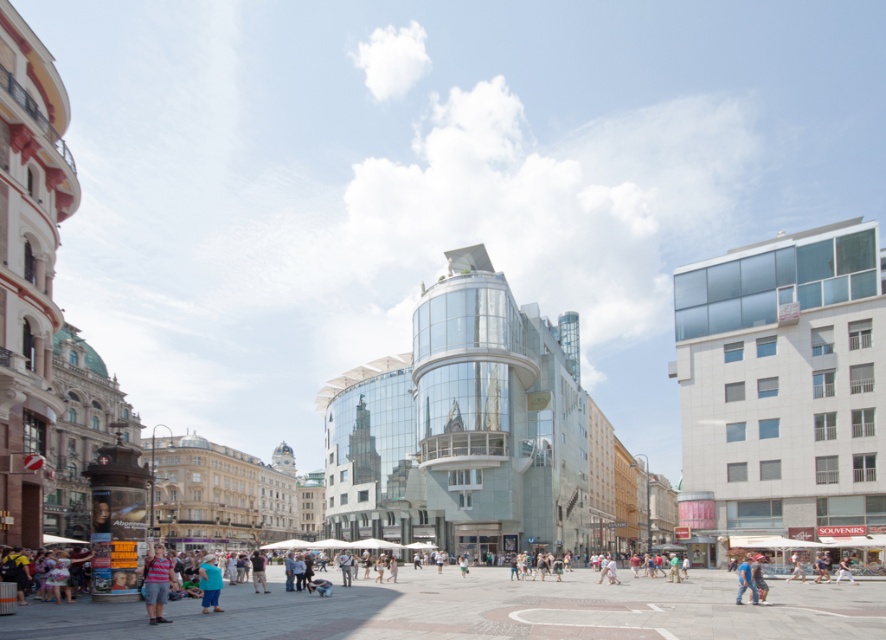
You are a fashion designer observing a person in the urban square. You notice the striped cotton shirt at lower center and the blue denim jeans at center. Which clothing item is covering the other?

The striped cotton shirt at lower center is positioned over the blue denim jeans at center, so it is covering the jeans.

You are standing at the entrance of the modern glass building at center right and want to find the striped cotton shirt at lower center. According to the coordinates provided, in which direction should you walk to reach it?

The striped cotton shirt at lower center is located at coordinate point 0.912 on the x axis and 0.178 on the y axis. Since you are at the entrance of the modern glass building at center right, you should walk towards the lower center direction to reach the striped cotton shirt at lower center.